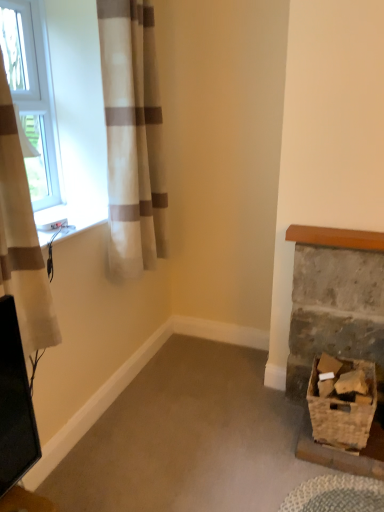
Identify the location of free space to the left of woven brown basket at lower right. Image resolution: width=384 pixels, height=512 pixels. [279, 439].